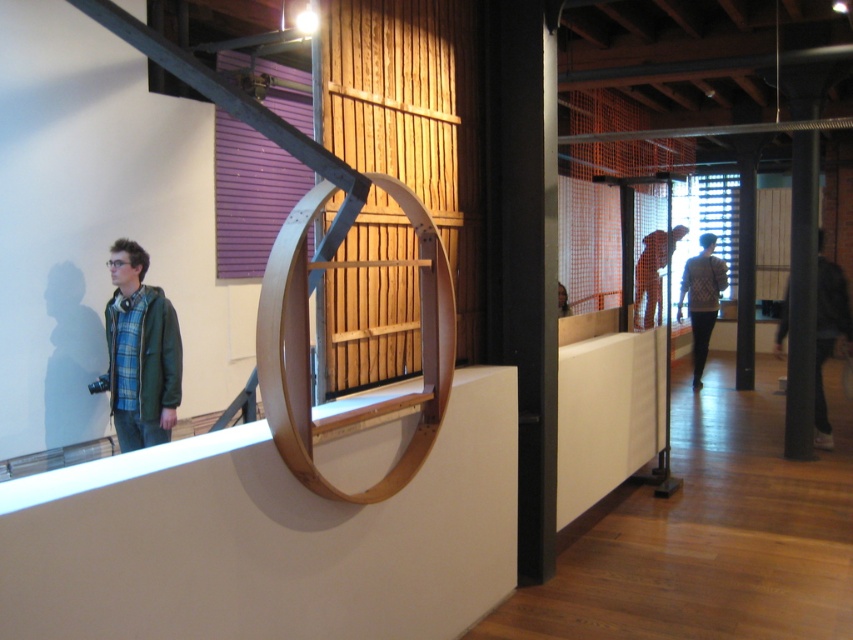
Does dark brown leather jacket at center right appear on the right side of orange fabric at center?

Indeed, dark brown leather jacket at center right is positioned on the right side of orange fabric at center.

Which is above, dark brown leather jacket at center right or orange fabric at center?

orange fabric at center is higher up.

Is point (843, 300) less distant than point (666, 253)?

No, (843, 300) is further to viewer.

Where is `dark brown leather jacket at center right`? The image size is (853, 640). dark brown leather jacket at center right is located at coordinates (827, 333).

What do you see at coordinates (140, 352) in the screenshot? The height and width of the screenshot is (640, 853). I see `green matte jacket at left` at bounding box center [140, 352].

Between green matte jacket at left and dark brown leather jacket at center right, which one has more height?

dark brown leather jacket at center right is taller.

Between point (165, 308) and point (824, 298), which one is positioned behind?

Positioned behind is point (824, 298).

Find the location of a particular element. This screenshot has height=640, width=853. green matte jacket at left is located at coordinates (140, 352).

Can you confirm if dark brown leather jacket at center right is positioned below knit sweater at center?

Indeed, dark brown leather jacket at center right is positioned under knit sweater at center.

Between point (827, 420) and point (686, 268), which one is positioned behind?

Point (686, 268)

This screenshot has height=640, width=853. In order to click on dark brown leather jacket at center right in this screenshot , I will do `click(827, 333)`.